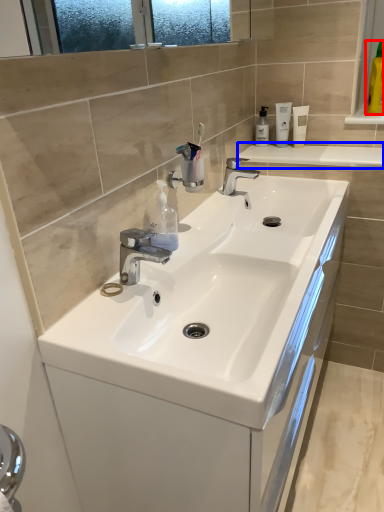
Question: Which of the following is the closest to the observer, mouthwash (highlighted by a red box) or counter top (highlighted by a blue box)?

Choices:
 (A) mouthwash
 (B) counter top

Answer: (B)